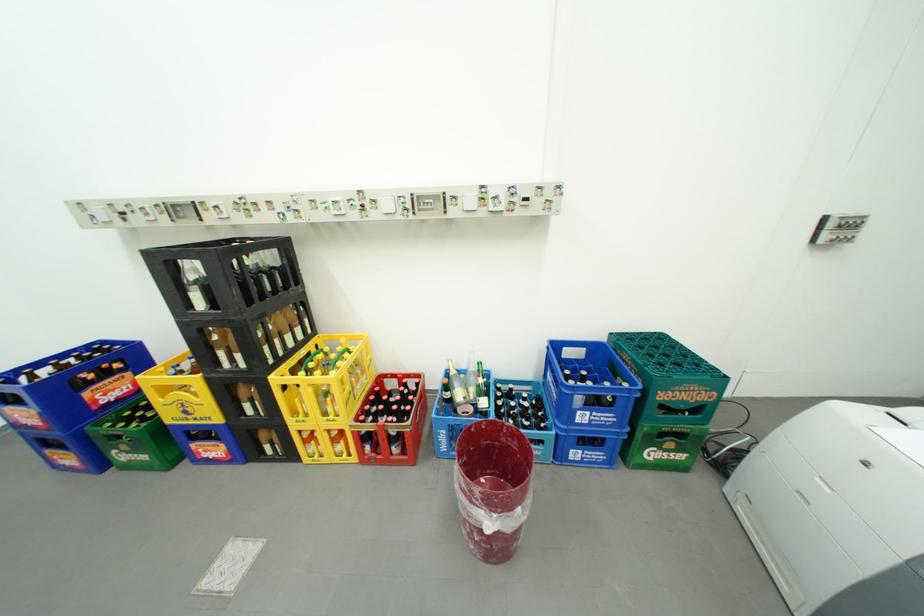
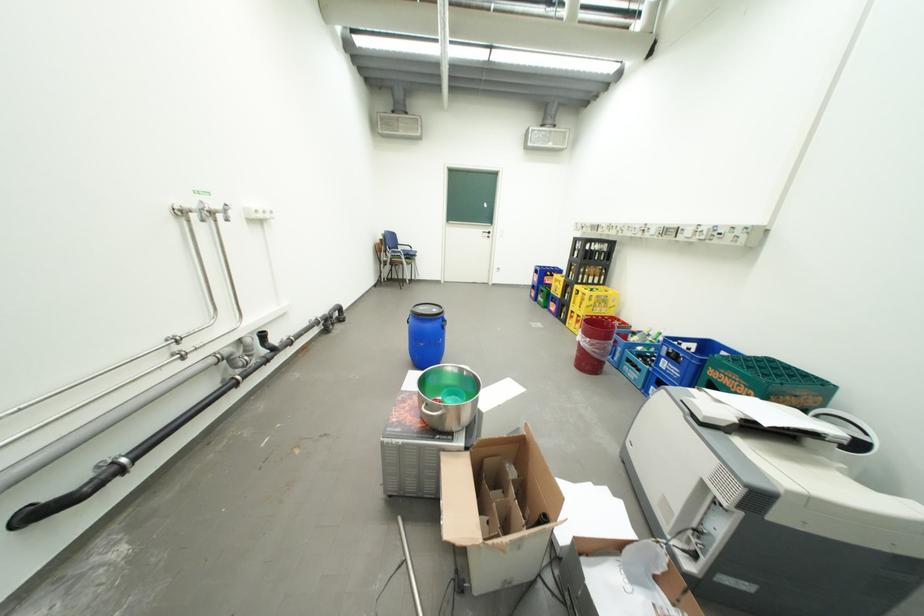
The point at (590, 414) is marked in the first image. Where is the corresponding point in the second image?

(674, 361)